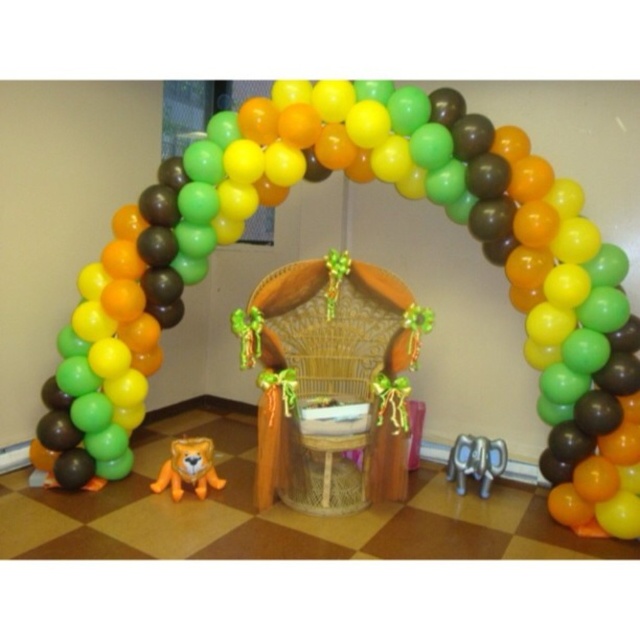
Is point (570, 372) farther from camera compared to point (337, 312)?

No.

Does balloon arch at center have a lesser width compared to woodenchair at center?

No.

Image resolution: width=640 pixels, height=640 pixels. I want to click on balloon arch at center, so click(404, 196).